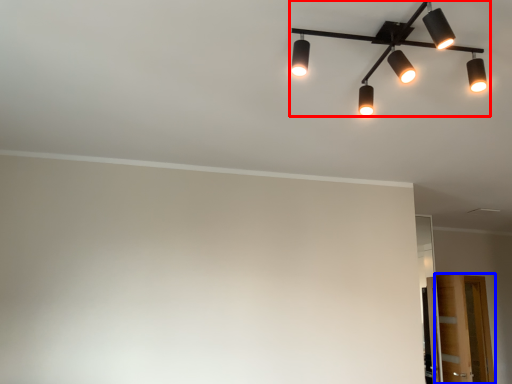
Question: Which of the following is the farthest to the observer, lamp (highlighted by a red box) or glass door (highlighted by a blue box)?

Choices:
 (A) lamp
 (B) glass door

Answer: (B)